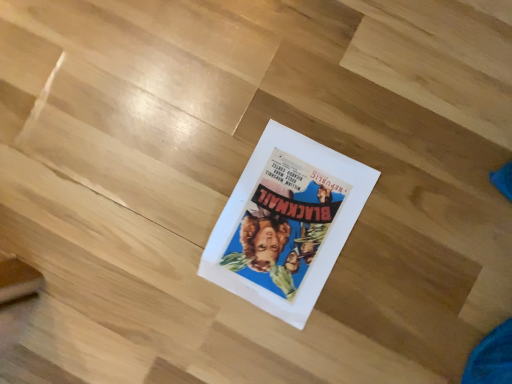
In order to click on vacant space behind white paper poster at center in this screenshot , I will do `click(205, 124)`.